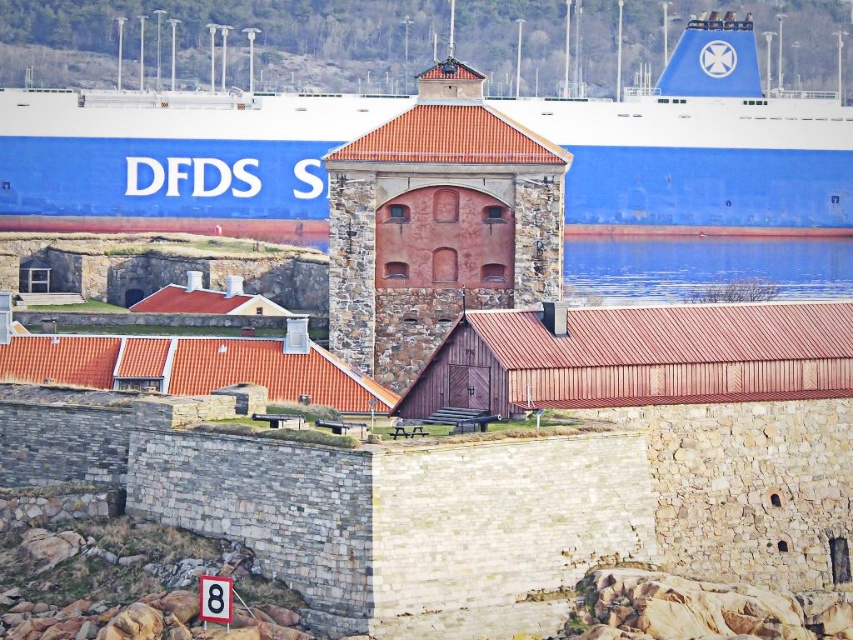
Is blue matte ship at upper center behind blue water at center?

That is False.

Is point (811, 124) behind point (598, 289)?

Yes, it is.

Find the location of a particular element. blue matte ship at upper center is located at coordinates (701, 147).